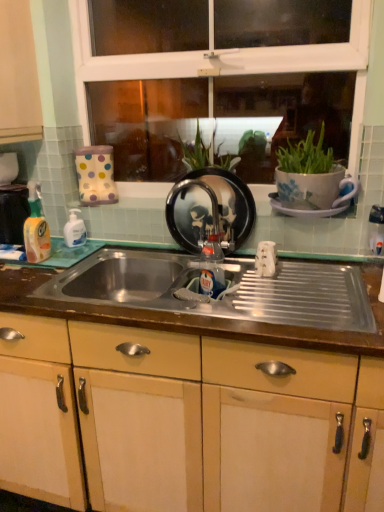
This screenshot has height=512, width=384. What do you see at coordinates (185, 415) in the screenshot?
I see `matte wood cabinetry at center, acting as the second cabinetry starting from the left` at bounding box center [185, 415].

Where is `matte wood cabinetry at center, the first cabinetry from the right`? The width and height of the screenshot is (384, 512). matte wood cabinetry at center, the first cabinetry from the right is located at coordinates (185, 415).

What is the approximate height of black glossy frying pan at center?

black glossy frying pan at center is 32.88 centimeters tall.

The height and width of the screenshot is (512, 384). Find the location of `clear glass window at upper center`. clear glass window at upper center is located at coordinates (225, 62).

From the image's perspective, does black glossy frying pan at center appear higher than translucent plastic bottle at center, arranged as the 1th bottle when viewed from the right?

Indeed, from the image's perspective, black glossy frying pan at center is shown above translucent plastic bottle at center, arranged as the 1th bottle when viewed from the right.

Consider the image. Is black glossy frying pan at center facing away from translucent plastic bottle at center, positioned as the third bottle in left-to-right order?

No, black glossy frying pan at center's orientation is not away from translucent plastic bottle at center, positioned as the third bottle in left-to-right order.

From a real-world perspective, is black glossy frying pan at center positioned under translucent plastic bottle at center, arranged as the 1th bottle when viewed from the right, based on gravity?

No, from a real-world perspective, black glossy frying pan at center is not below translucent plastic bottle at center, arranged as the 1th bottle when viewed from the right.

Based on their sizes in the image, would you say black glossy frying pan at center is bigger or smaller than translucent plastic bottle at center, positioned as the third bottle in left-to-right order?

In the image, black glossy frying pan at center appears to be larger than translucent plastic bottle at center, positioned as the third bottle in left-to-right order.

Does translucent plastic bottle at center, arranged as the 1th bottle when viewed from the right, contain black glossy frying pan at center?

No, black glossy frying pan at center is not inside translucent plastic bottle at center, arranged as the 1th bottle when viewed from the right.

Identify the location of the 2nd bottle in front of the black glossy frying pan at center. This screenshot has height=512, width=384. (211, 282).

Can you see translucent plastic bottle at center, arranged as the 1th bottle when viewed from the right, touching black glossy frying pan at center?

translucent plastic bottle at center, arranged as the 1th bottle when viewed from the right, is not next to black glossy frying pan at center, and they're not touching.

Is translucent plastic bottle at center, arranged as the 1th bottle when viewed from the right, turned away from white glossy bottle at left, the 2th bottle in the right-to-left sequence?

No, translucent plastic bottle at center, arranged as the 1th bottle when viewed from the right, is not facing the opposite direction of white glossy bottle at left, the 2th bottle in the right-to-left sequence.

Which of these two, translucent plastic bottle at center, positioned as the third bottle in left-to-right order, or white glossy bottle at left, the 2th bottle viewed from the left, is bigger?

translucent plastic bottle at center, positioned as the third bottle in left-to-right order.

Is there a large distance between translucent plastic bottle at center, positioned as the third bottle in left-to-right order, and white glossy bottle at left, the 2th bottle viewed from the left?

Actually, translucent plastic bottle at center, positioned as the third bottle in left-to-right order, and white glossy bottle at left, the 2th bottle viewed from the left, are a little close together.

Consider the image. Who is taller, translucent plastic bottle at center, arranged as the 1th bottle when viewed from the right, or white glossy bottle at left, the 2th bottle in the right-to-left sequence?

translucent plastic bottle at center, arranged as the 1th bottle when viewed from the right.

From the image's perspective, which is above, clear glass window at upper center or metallic stainless steel sink at center?

clear glass window at upper center appears higher in the image.

At what (x,y) coordinates should I click in order to perform the action: click on countertop on the left of clear glass window at upper center. Please return your answer as a coordinate pair (x, y). Image resolution: width=384 pixels, height=512 pixels. Looking at the image, I should click on (214, 305).

Which point is more forward, (x=209, y=28) or (x=286, y=260)?

The point (x=286, y=260) is more forward.

From the picture: Can you confirm if clear glass window at upper center is taller than metallic stainless steel sink at center?

Yes.

Considering the positions of objects clear glass window at upper center and translucent plastic bottle at center, arranged as the 1th bottle when viewed from the right, in the image provided, who is in front, clear glass window at upper center or translucent plastic bottle at center, arranged as the 1th bottle when viewed from the right,?

translucent plastic bottle at center, arranged as the 1th bottle when viewed from the right, is closer to the camera.

Who is smaller, clear glass window at upper center or translucent plastic bottle at center, positioned as the third bottle in left-to-right order?

translucent plastic bottle at center, positioned as the third bottle in left-to-right order.

What's the angular difference between clear glass window at upper center and translucent plastic bottle at center, arranged as the 1th bottle when viewed from the right,'s facing directions?

35.6 degrees.

Is point (77, 22) farther from viewer compared to point (217, 275)?

That is True.

Identify the location of bottle located behind the black glossy frying pan at center. (74, 230).

Does black glossy frying pan at center appear on the left side of white glossy bottle at left, the 2th bottle in the right-to-left sequence?

Incorrect, black glossy frying pan at center is not on the left side of white glossy bottle at left, the 2th bottle in the right-to-left sequence.

Considering the positions of points (183, 245) and (66, 244), is point (183, 245) closer to camera compared to point (66, 244)?

Yes, point (183, 245) is closer to viewer.

Considering the sizes of objects black glossy frying pan at center and white glossy bottle at left, the 2th bottle viewed from the left, in the image provided, who is taller, black glossy frying pan at center or white glossy bottle at left, the 2th bottle viewed from the left,?

black glossy frying pan at center.

Does matte wood cabinetry at center, acting as the second cabinetry starting from the left, appear on the left side of clear glass window at upper center?

Correct, you'll find matte wood cabinetry at center, acting as the second cabinetry starting from the left, to the left of clear glass window at upper center.

Locate an element on the screen. cabinetry below the clear glass window at upper center (from a real-world perspective) is located at coordinates (185, 415).

Which of these two, matte wood cabinetry at center, which appears as the 2th cabinetry when viewed from the top, or clear glass window at upper center, stands shorter?

clear glass window at upper center is shorter.

From the black glossy frying pan at center, count 2nd bottles forward and point to it. Please provide its 2D coordinates.

[(211, 282)]

Find the location of a particular element. The image size is (384, 512). appliance that is above the translucent plastic bottle at center, arranged as the 1th bottle when viewed from the right (from the image's perspective) is located at coordinates coord(210,209).

When comparing their distances from white glossy bottle at left, the 2th bottle in the right-to-left sequence, does translucent plastic bottle at center, arranged as the 1th bottle when viewed from the right, or yellow translucent liquid at left, the third bottle positioned from the right, seem closer?

yellow translucent liquid at left, the third bottle positioned from the right.

Looking at the image, which one is located closer to matte wood cabinet at left, arranged as the second cabinetry when ordered from the bottom, white glossy bottle at left, the 2th bottle in the right-to-left sequence, or yellow translucent liquid at left, placed as the first bottle when sorted from left to right?

Among the two, yellow translucent liquid at left, placed as the first bottle when sorted from left to right, is located nearer to matte wood cabinet at left, arranged as the second cabinetry when ordered from the bottom.

When comparing their distances from white glossy bottle at left, the 2th bottle viewed from the left, does black glossy frying pan at center or metallic stainless steel sink at center seem further?

metallic stainless steel sink at center is further to white glossy bottle at left, the 2th bottle viewed from the left.

Estimate the real-world distances between objects in this image. Which object is further from matte wood cabinetry at center, the first cabinetry from the right, clear glass window at upper center or matte wood cabinet at left, the first cabinetry viewed from the top?

clear glass window at upper center.

Which object lies further to the anchor point metallic stainless steel sink at center, matte wood cabinetry at center, the 1th cabinetry from the bottom, or matte wood cabinet at left, the first cabinetry viewed from the top?

matte wood cabinet at left, the first cabinetry viewed from the top, lies further to metallic stainless steel sink at center than the other object.

Estimate the real-world distances between objects in this image. Which object is further from translucent plastic bottle at center, arranged as the 1th bottle when viewed from the right, clear glass window at upper center or metallic stainless steel sink at center?

clear glass window at upper center lies further to translucent plastic bottle at center, arranged as the 1th bottle when viewed from the right, than the other object.

Which object lies nearer to the anchor point translucent plastic bottle at center, arranged as the 1th bottle when viewed from the right, clear glass window at upper center or matte wood cabinetry at center, acting as the second cabinetry starting from the left?

Based on the image, matte wood cabinetry at center, acting as the second cabinetry starting from the left, appears to be nearer to translucent plastic bottle at center, arranged as the 1th bottle when viewed from the right.

Estimate the real-world distances between objects in this image. Which object is closer to yellow translucent liquid at left, placed as the first bottle when sorted from left to right, metallic stainless steel sink at center or translucent plastic bottle at center, arranged as the 1th bottle when viewed from the right?

Based on the image, metallic stainless steel sink at center appears to be nearer to yellow translucent liquid at left, placed as the first bottle when sorted from left to right.

At what (x,y) coordinates should I click in order to perform the action: click on countertop located between white glossy bottle at left, the 2th bottle viewed from the left, and translucent plastic bottle at center, positioned as the third bottle in left-to-right order, in the left-right direction. Please return your answer as a coordinate pair (x, y). Looking at the image, I should click on 214,305.

Locate an element on the screen. The image size is (384, 512). bottle between yellow translucent liquid at left, placed as the first bottle when sorted from left to right, and black glossy frying pan at center is located at coordinates click(x=74, y=230).

In order to click on appliance situated between matte wood cabinet at left, the first cabinetry when ordered from left to right, and clear glass window at upper center from left to right in this screenshot , I will do `click(210, 209)`.

Where is `countertop situated between matte wood cabinet at left, the 2th cabinetry in the right-to-left sequence, and black glossy frying pan at center from left to right`? The width and height of the screenshot is (384, 512). countertop situated between matte wood cabinet at left, the 2th cabinetry in the right-to-left sequence, and black glossy frying pan at center from left to right is located at coordinates (214, 305).